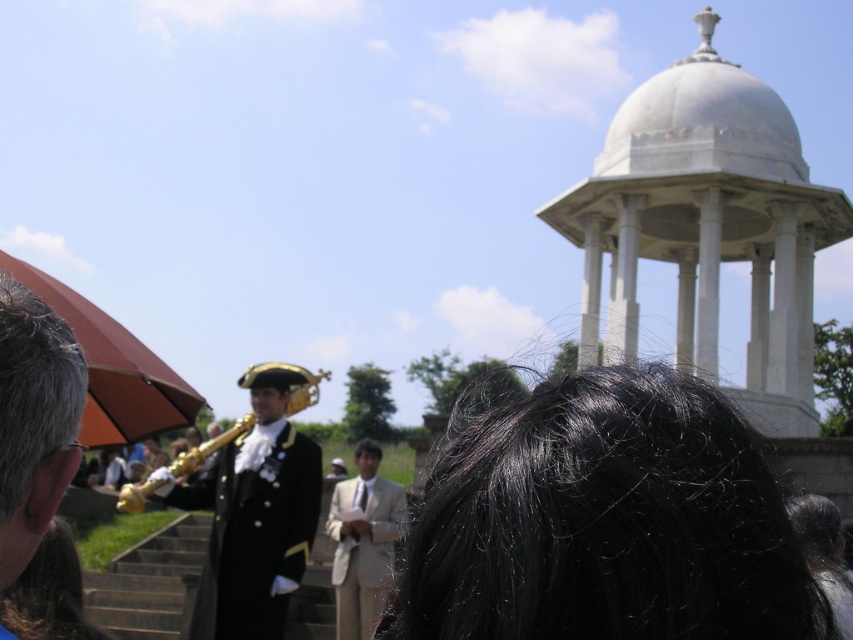
Which is more to the left, shiny black coat at center or brown matte umbrella at upper left?

Positioned to the left is brown matte umbrella at upper left.

Between point (265, 547) and point (175, 396), which one is positioned in front?

Point (265, 547) is in front.

Where is `shiny black coat at center`? shiny black coat at center is located at coordinates (256, 509).

Can you confirm if white marble gazebo at upper right is smaller than brown matte umbrella at upper left?

No, white marble gazebo at upper right is not smaller than brown matte umbrella at upper left.

This screenshot has height=640, width=853. I want to click on white marble gazebo at upper right, so click(706, 227).

Is white marble gazebo at upper right smaller than gold brass instrument at center?

No.

Is the position of white marble gazebo at upper right more distant than that of gold brass instrument at center?

No, it is in front of gold brass instrument at center.

Does point (701, 45) come closer to viewer compared to point (129, 502)?

No, (701, 45) is further to viewer.

Where is `white marble gazebo at upper right`? The width and height of the screenshot is (853, 640). white marble gazebo at upper right is located at coordinates (706, 227).